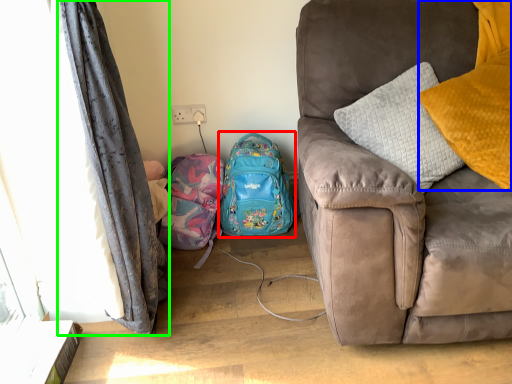
Question: Based on their relative distances, which object is nearer to backpack (highlighted by a red box)? Choose from pillow (highlighted by a blue box) and curtain (highlighted by a green box).

Choices:
 (A) pillow
 (B) curtain

Answer: (B)